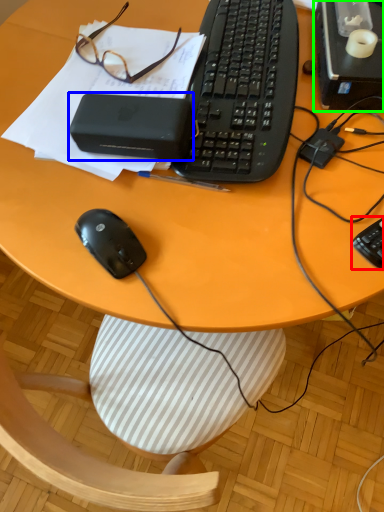
Question: Based on their relative distances, which object is nearer to computer keyboard (highlighted by a red box)? Choose from gadget (highlighted by a blue box) and desktop computer (highlighted by a green box).

Choices:
 (A) gadget
 (B) desktop computer

Answer: (B)